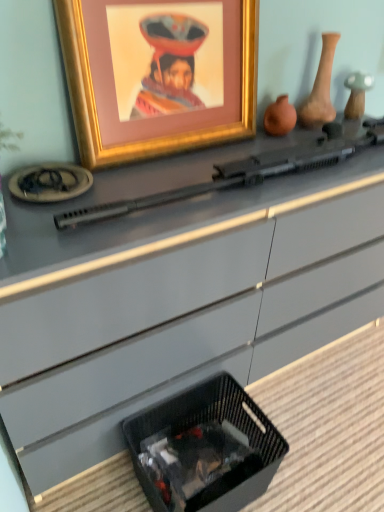
Question: From a real-world perspective, is matte clay vase at upper right, the first vase from the right, under gold-framed picture at upper center?

Choices:
 (A) yes
 (B) no

Answer: (A)

Question: Is matte clay vase at upper right, placed as the second vase when sorted from left to right, positioned beyond the bounds of gold-framed picture at upper center?

Choices:
 (A) no
 (B) yes

Answer: (B)

Question: Would you consider matte clay vase at upper right, the first vase from the right, to be distant from gold-framed picture at upper center?

Choices:
 (A) yes
 (B) no

Answer: (B)

Question: Is matte clay vase at upper right, placed as the second vase when sorted from left to right, shorter than gold-framed picture at upper center?

Choices:
 (A) no
 (B) yes

Answer: (B)

Question: From the image's perspective, is matte clay vase at upper right, the first vase from the right, below gold-framed picture at upper center?

Choices:
 (A) yes
 (B) no

Answer: (B)

Question: Is gold-framed picture at upper center located within matte clay vase at upper right, the first vase from the right?

Choices:
 (A) yes
 (B) no

Answer: (B)

Question: Is black woven basket at lower center taller than black plastic rifle at center?

Choices:
 (A) no
 (B) yes

Answer: (B)

Question: Is black woven basket at lower center thinner than black plastic rifle at center?

Choices:
 (A) yes
 (B) no

Answer: (B)

Question: From the image's perspective, is black woven basket at lower center located beneath black plastic rifle at center?

Choices:
 (A) yes
 (B) no

Answer: (A)

Question: From a real-world perspective, is black woven basket at lower center located beneath black plastic rifle at center?

Choices:
 (A) yes
 (B) no

Answer: (A)

Question: Is black woven basket at lower center to the right of black plastic rifle at center from the viewer's perspective?

Choices:
 (A) no
 (B) yes

Answer: (A)

Question: Are black woven basket at lower center and black plastic rifle at center located far from each other?

Choices:
 (A) no
 (B) yes

Answer: (A)

Question: Could you tell me if gold-framed picture at upper center is turned towards black woven basket at lower center?

Choices:
 (A) yes
 (B) no

Answer: (B)